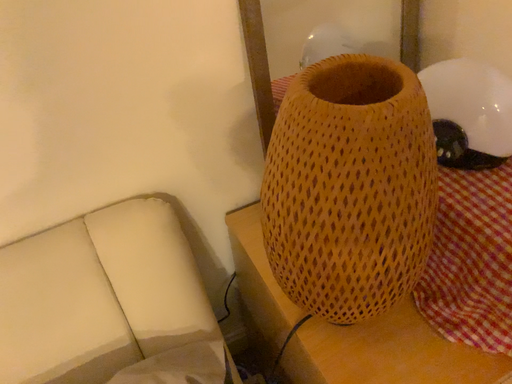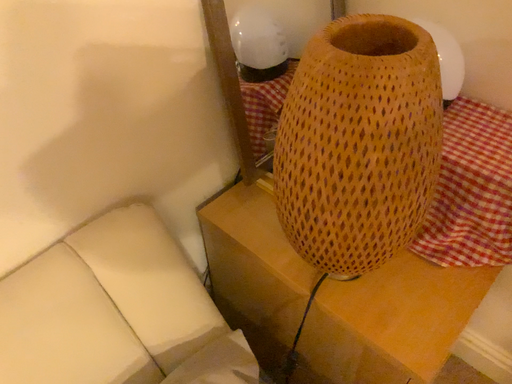
Question: How did the camera likely rotate when shooting the video?

Choices:
 (A) rotated left
 (B) rotated right

Answer: (B)